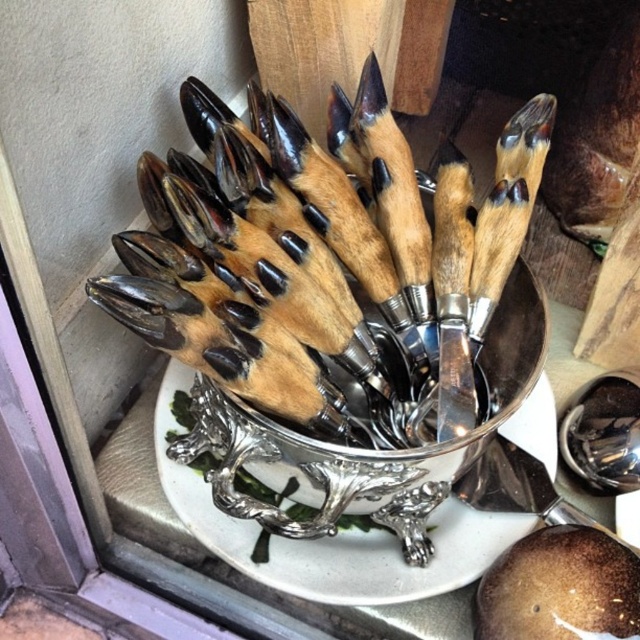
Question: Which object is closer to the camera taking this photo?

Choices:
 (A) silver metallic bowl at center
 (B) polished silver spoon at center

Answer: (A)

Question: Does silver metallic bowl at center have a smaller size compared to polished silver spoon at center?

Choices:
 (A) yes
 (B) no

Answer: (B)

Question: Which point is closer to the camera taking this photo?

Choices:
 (A) (589, 465)
 (B) (481, 385)

Answer: (B)

Question: Where is silver metallic bowl at center located in relation to polished silver spoon at center in the image?

Choices:
 (A) right
 (B) left

Answer: (B)

Question: Can you confirm if silver metallic bowl at center is smaller than polished silver spoon at center?

Choices:
 (A) yes
 (B) no

Answer: (B)